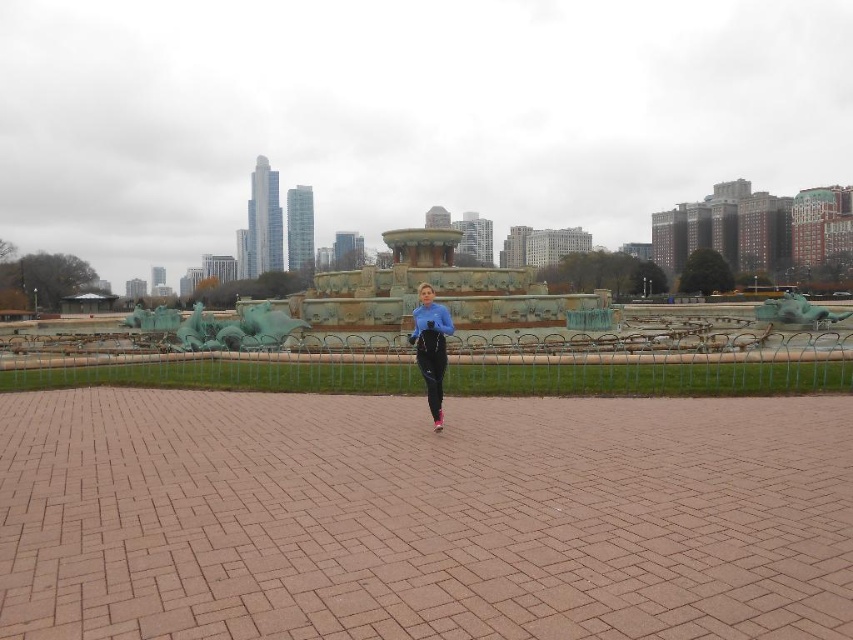
Question: Where is brown brick path at center located in relation to green patina fountain at center in the image?

Choices:
 (A) above
 (B) below

Answer: (B)

Question: Which is farther from the green patina fountain at center?

Choices:
 (A) blue fabric pants at center
 (B) brown brick path at center

Answer: (B)

Question: Considering the real-world distances, which object is farthest from the brown brick path at center?

Choices:
 (A) blue fabric pants at center
 (B) green patina fountain at center

Answer: (B)

Question: Can you confirm if brown brick path at center is positioned to the left of green patina fountain at center?

Choices:
 (A) yes
 (B) no

Answer: (A)

Question: Is green patina fountain at center further to the viewer compared to blue fabric pants at center?

Choices:
 (A) yes
 (B) no

Answer: (A)

Question: Estimate the real-world distances between objects in this image. Which object is closer to the blue fabric pants at center?

Choices:
 (A) green patina fountain at center
 (B) brown brick path at center

Answer: (B)